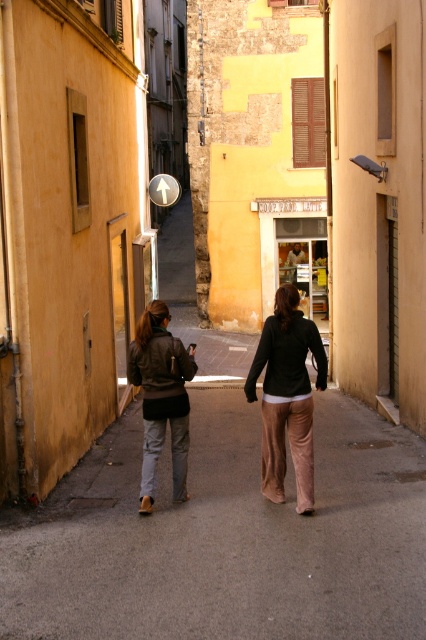
Which is below, leather jacket at center or matte brown jacket at center?

matte brown jacket at center

Does leather jacket at center appear on the right side of matte brown jacket at center?

Indeed, leather jacket at center is positioned on the right side of matte brown jacket at center.

What do you see at coordinates (287, 396) in the screenshot?
I see `leather jacket at center` at bounding box center [287, 396].

This screenshot has height=640, width=426. Find the location of `leather jacket at center`. leather jacket at center is located at coordinates (287, 396).

Which is below, smooth concrete pavement at center or leather jacket at center?

smooth concrete pavement at center is lower down.

You are a GUI agent. You are given a task and a screenshot of the screen. Output one action in this format:
    pyautogui.click(x=<x>, y=<y>)
    Task: Click on the smooth concrete pavement at center
    This screenshot has height=640, width=426.
    Given the screenshot: What is the action you would take?
    pyautogui.click(x=226, y=538)

Is point (331, 548) closer to viewer compared to point (302, 422)?

That is True.

Looking at this image, does smooth concrete pavement at center appear on the left side of matte black jacket at center?

Correct, you'll find smooth concrete pavement at center to the left of matte black jacket at center.

Between point (351, 625) and point (321, 372), which one is positioned in front?

Positioned in front is point (351, 625).

The width and height of the screenshot is (426, 640). I want to click on smooth concrete pavement at center, so click(x=226, y=538).